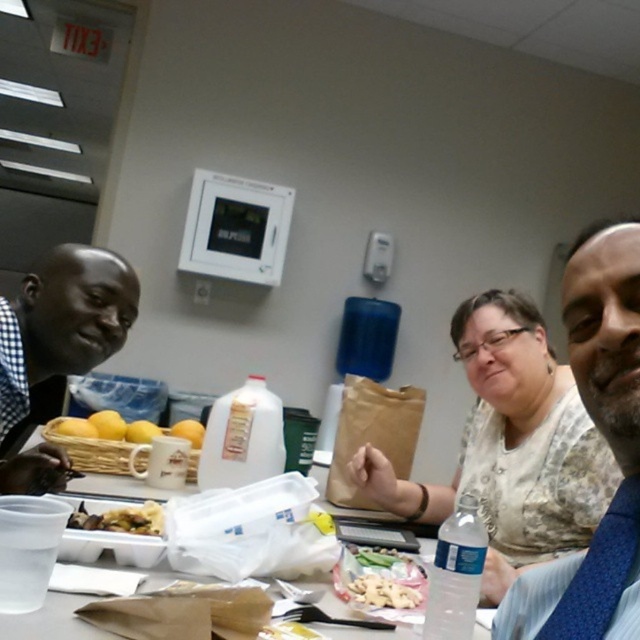
Who is more forward, (540, 577) or (32, 355)?

Positioned in front is point (540, 577).

Who is more distant from viewer, (x=632, y=621) or (x=42, y=337)?

The point (x=42, y=337) is more distant.

At what (x,y) coordinates should I click in order to perform the action: click on blue textured shirt at right. Please return your answer as a coordinate pair (x, y). Image resolution: width=640 pixels, height=640 pixels. Looking at the image, I should click on pyautogui.click(x=609, y=444).

This screenshot has width=640, height=640. Identify the location of white plastic table at center. (113, 488).

Is white plastic table at center thinner than white crumbly pastry at center?

Incorrect, white plastic table at center's width is not less than white crumbly pastry at center's.

You are a GUI agent. You are given a task and a screenshot of the screen. Output one action in this format:
    pyautogui.click(x=<x>, y=<y>)
    Task: Click on the white plastic table at center
    Image resolution: width=640 pixels, height=640 pixels.
    Given the screenshot: What is the action you would take?
    pyautogui.click(x=113, y=488)

Who is higher up, blue textured shirt at right or brown crumbly at center?

blue textured shirt at right

Does blue textured shirt at right appear on the right side of brown crumbly at center?

Yes, blue textured shirt at right is to the right of brown crumbly at center.

Is point (625, 492) closer to camera compared to point (120, 520)?

Yes, it is in front of point (120, 520).

What are the coordinates of `blue textured shirt at right` in the screenshot? It's located at (609, 444).